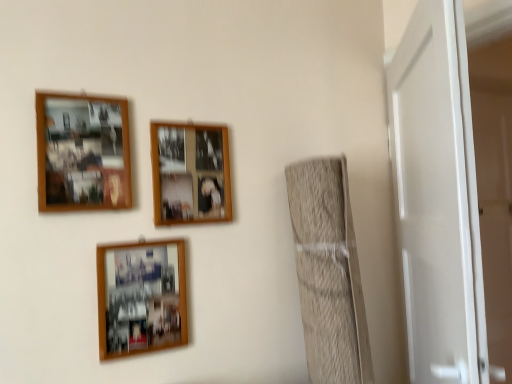
Question: From the image's perspective, is wooden photo frame at upper left, acting as the 1th picture frame starting from the top, positioned above or below white glossy door at right?

Choices:
 (A) below
 (B) above

Answer: (B)

Question: Relative to white glossy door at right, is wooden photo frame at upper left, acting as the 1th picture frame starting from the top, in front or behind?

Choices:
 (A) front
 (B) behind

Answer: (B)

Question: Based on their relative distances, which object is farther from the wooden photo frame at lower center, which is the third picture frame in top-to-bottom order?

Choices:
 (A) wooden photo frame at upper left, acting as the 1th picture frame starting from the top
 (B) white glossy door at right
 (C) woodenobject at upper center, arranged as the 2th picture frame when viewed from the top

Answer: (B)

Question: Estimate the real-world distances between objects in this image. Which object is closer to the woodenobject at upper center, arranged as the 2th picture frame when viewed from the top?

Choices:
 (A) wooden photo frame at lower center, which appears as the first picture frame when ordered from the bottom
 (B) white glossy door at right
 (C) wooden photo frame at upper left, positioned as the 3th picture frame in bottom-to-top order

Answer: (C)